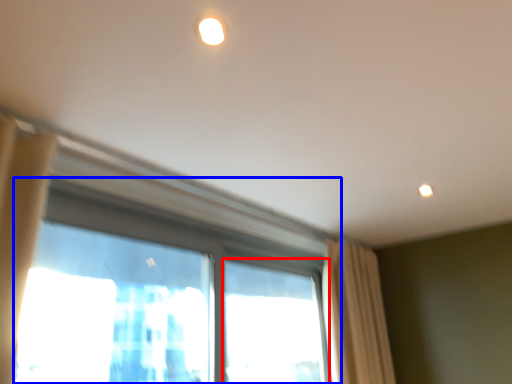
Question: Which of the following is the closest to the observer, window (highlighted by a red box) or window (highlighted by a blue box)?

Choices:
 (A) window
 (B) window

Answer: (B)